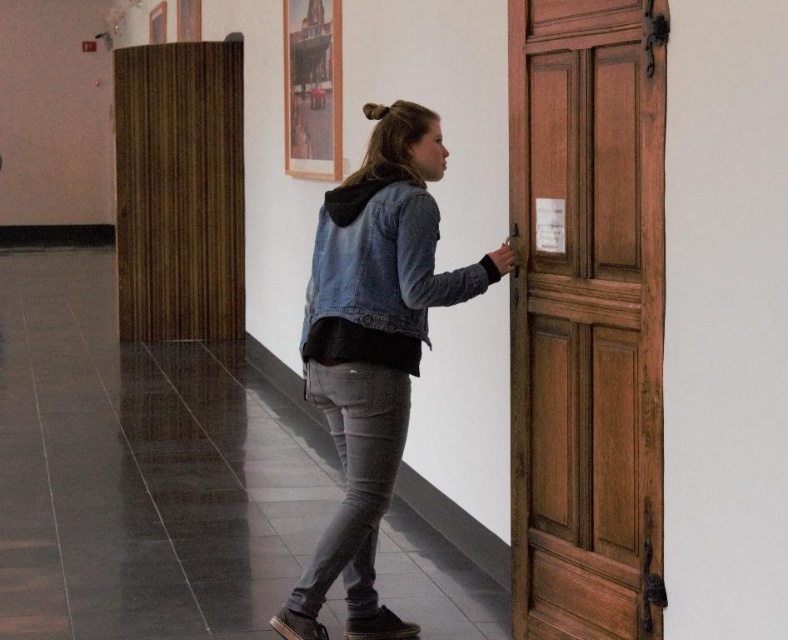
You are a delivery person trying to hand a package to the person wearing the denim jacket at center. The wooden panelled door at right is in your way. Can you reach the person without moving the door?

The wooden panelled door at right is positioned over denim jacket at center, so the door is blocking the path to the person. You need to move the door to reach the person wearing the denim jacket at center.

Consider the image. You are a delivery person carrying a large box that is 1.2 meters wide. You need to pass through the wooden panelled door at right and the denim jacket at center. Which one do you think the box will not fit through?

The wooden panelled door at right has a lesser width compared to denim jacket at center, so the box that is 1.2 meters wide will not fit through the wooden panelled door at right.

You are a delivery person carrying a large package that is 26 inches wide. You are standing in the hallway and see the wooden panelled door at right and the denim jacket at center. Can you fit the package between the two objects without touching them?

The wooden panelled door at right is 25.39 inches away from the denim jacket at center. Since the package is 26 inches wide, it cannot fit between them as the distance is slightly less than the package width.